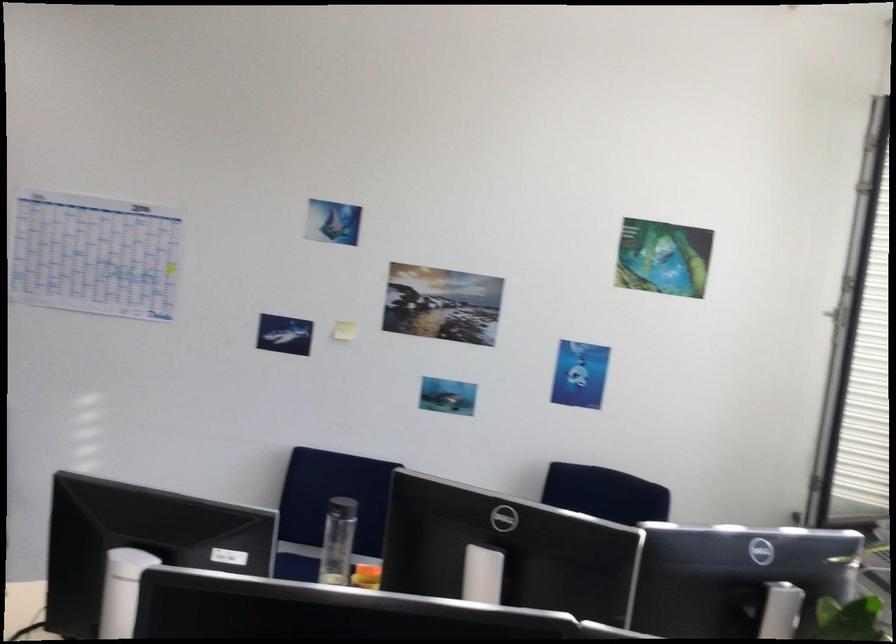
The width and height of the screenshot is (896, 644). What do you see at coordinates (341, 507) in the screenshot? I see `the black bottle cap` at bounding box center [341, 507].